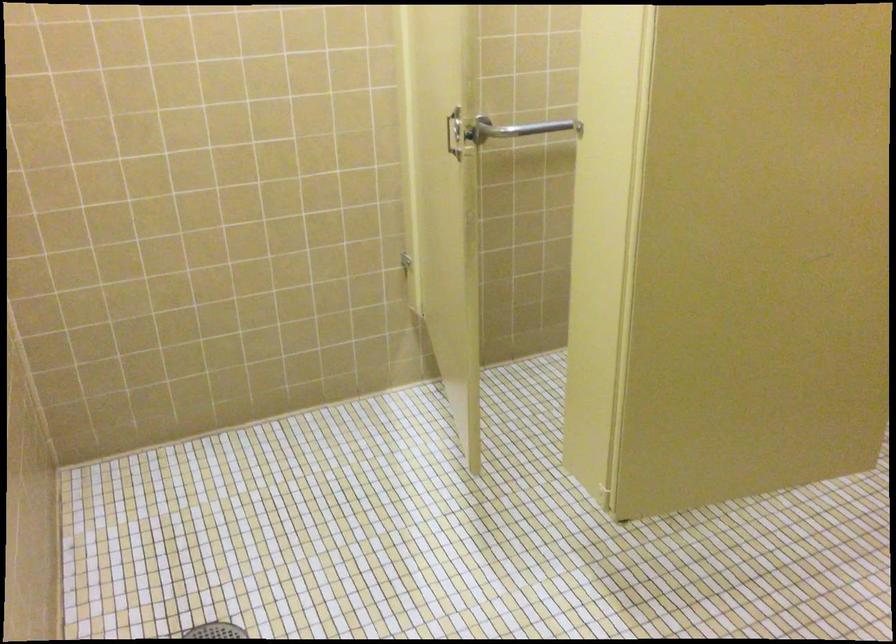
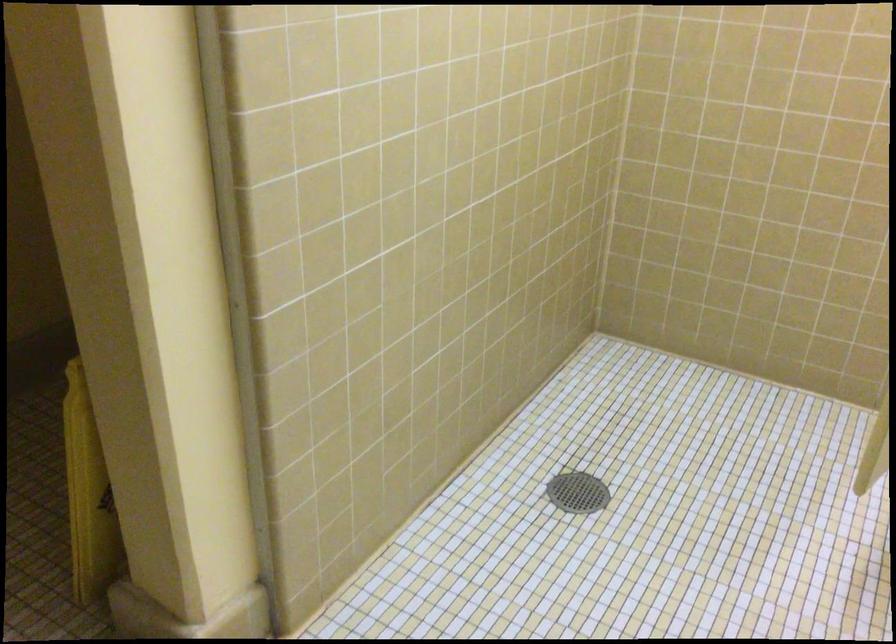
Question: The first image is from the beginning of the video and the second image is from the end. How did the camera likely rotate when shooting the video?

Choices:
 (A) Left
 (B) Right
 (C) Up
 (D) Down

Answer: (A)